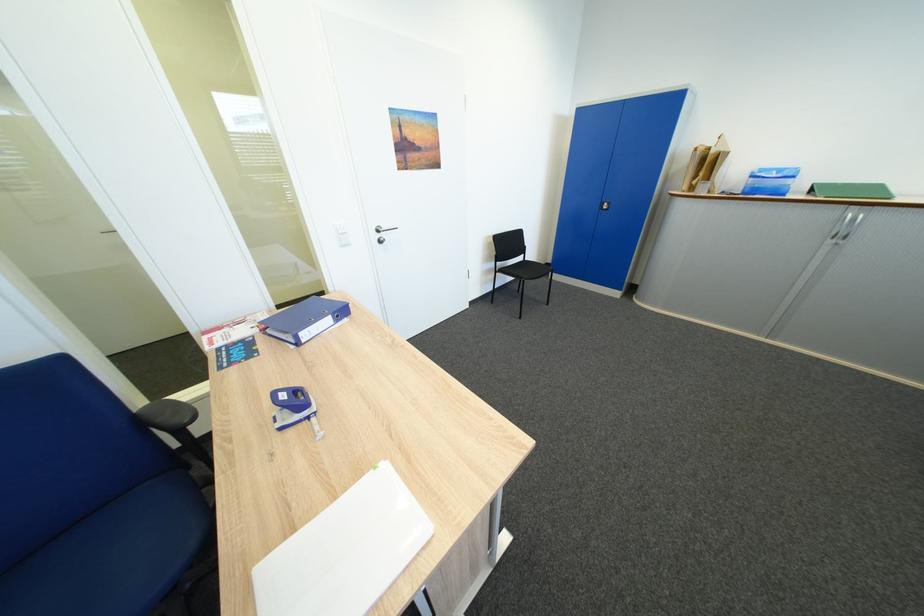
Locate an element on the screen. This screenshot has height=616, width=924. blue ring binder is located at coordinates (305, 320).